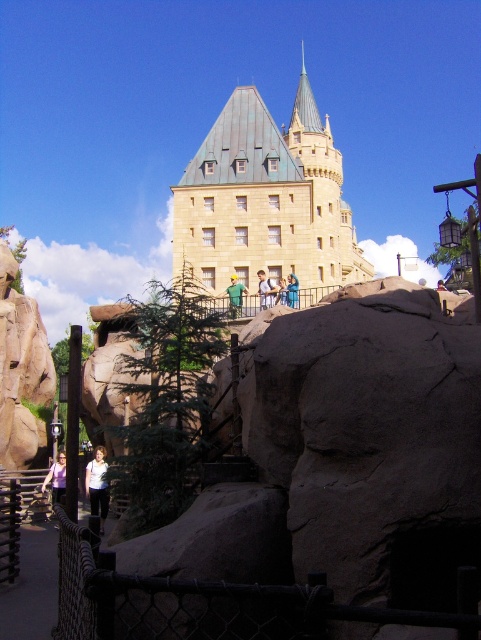
In the scene shown: You are a photographer at the amusement park and want to capture both the light blue denim jacket at center and the blue denim jeans at center in a single frame. Which object should you position closer to the left side of your camera viewfinder to ensure both are included?

To include both the light blue denim jacket at center and the blue denim jeans at center in the frame, position the light blue denim jacket at center closer to the left side of the camera viewfinder since it is already to the left of the blue denim jeans at center.

You are standing at the amusement park near the castle structure. You see two points marked in the image. The first point is at coordinates point [53,474] and the second is at point [273,298]. Which point is closer to you?

Point [53,474] is in front of point [273,298], so it is closer to you.

You are a visitor at the amusement park and want to take a photo of the stone tower at center without any people blocking it. The green fabric shirt at center is currently in the way. Since you can only move sideways, which direction should you move to get a clear shot?

The stone tower at center is wider than the green fabric shirt at center. Moving sideways to the left or right would allow you to position yourself so the shirt is no longer in the frame, as the tower is wider and likely occupies more of the background.